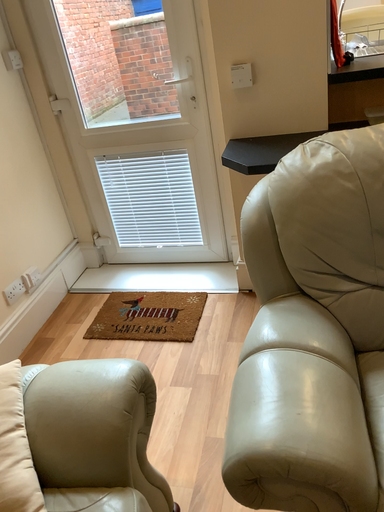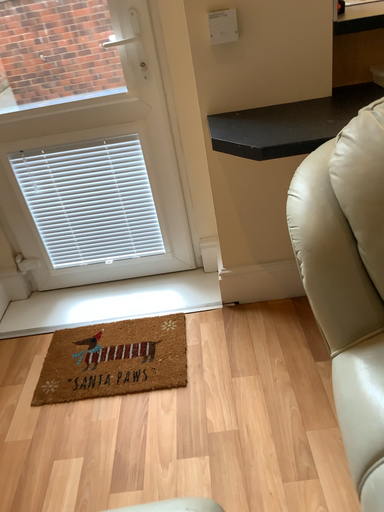
Question: Which way did the camera rotate in the video?

Choices:
 (A) rotated left
 (B) rotated right

Answer: (B)